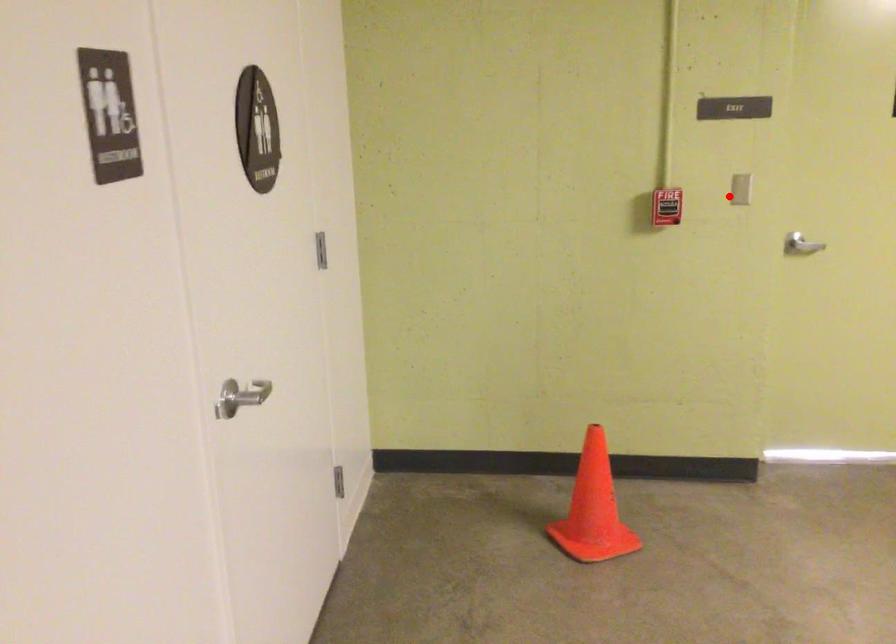
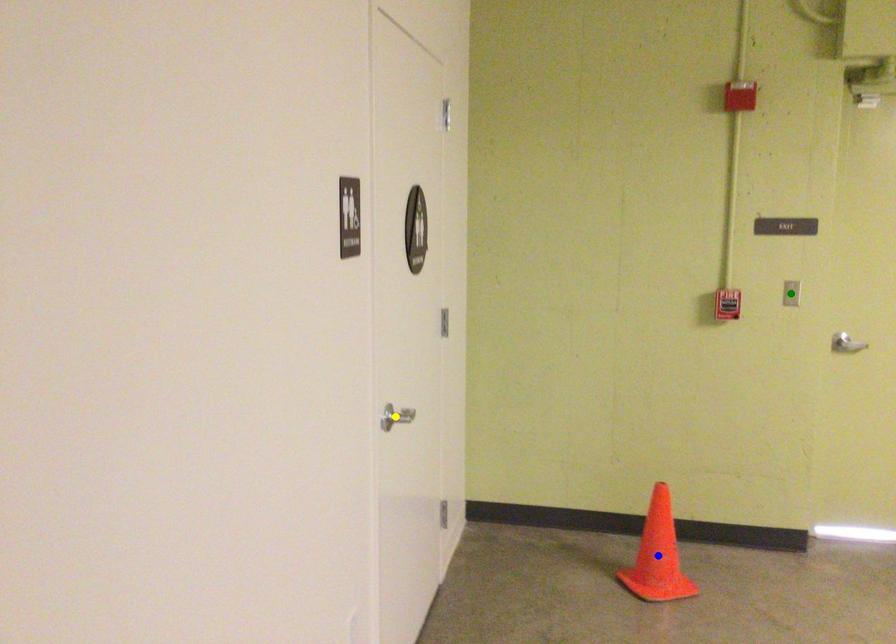
Question: I am providing you with two images of the same scene from different viewpoints. A red point is marked on the first image. You are given multiple points on the second image. Can you choose the point in image 2 that corresponds to the point in image 1?

Choices:
 (A) green point
 (B) blue point
 (C) yellow point

Answer: (A)